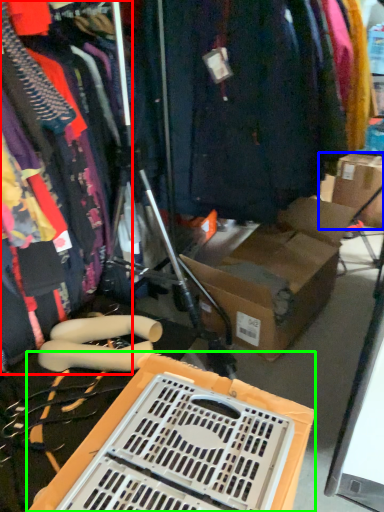
Question: Which is farther away from clothing (highlighted by a red box)? cardboard box (highlighted by a blue box) or storage box (highlighted by a green box)?

Choices:
 (A) cardboard box
 (B) storage box

Answer: (A)